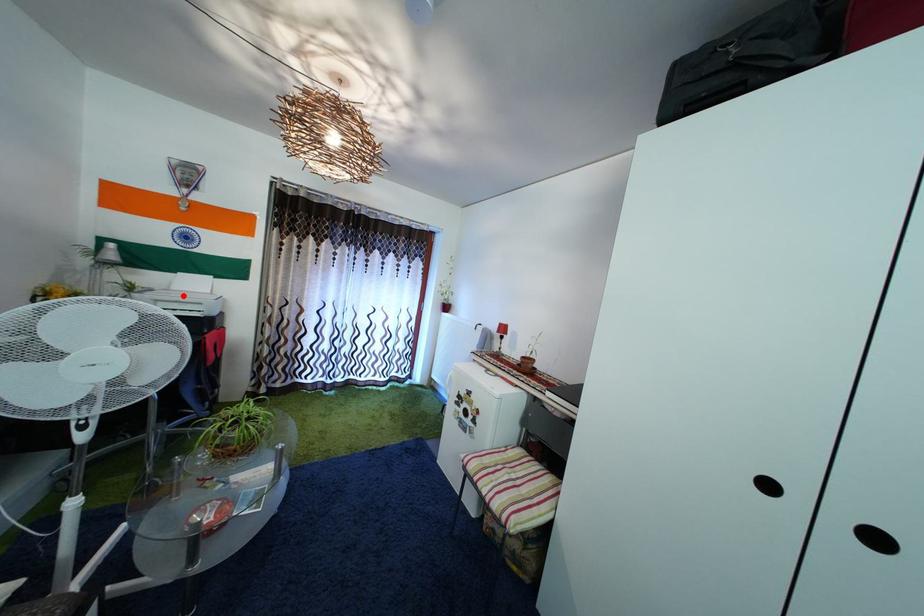
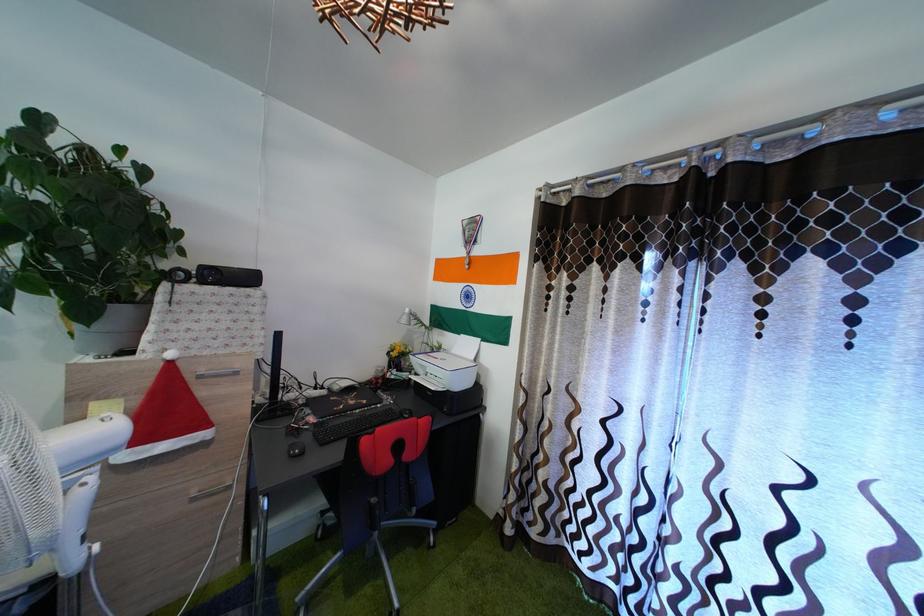
Find the pixel in the second image that matches the highlighted location in the first image.

(462, 359)